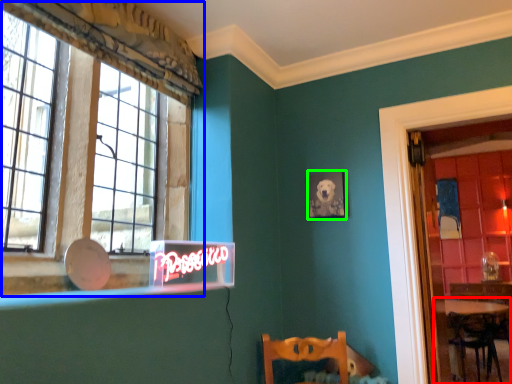
Question: Which object is the closest to the table (highlighted by a red box)? Choose among these: window (highlighted by a blue box) or picture frame (highlighted by a green box).

Choices:
 (A) window
 (B) picture frame

Answer: (B)